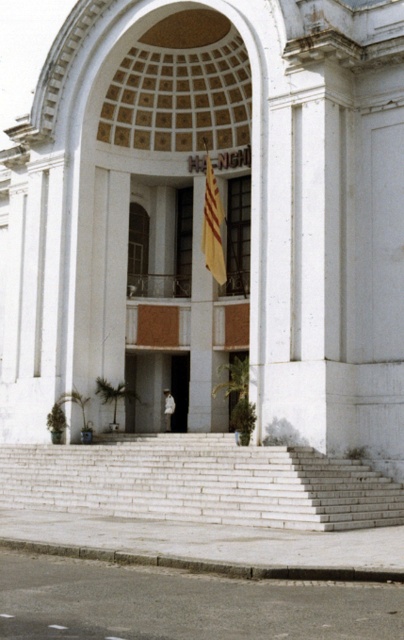
Question: Can you confirm if white stone stairs at center is positioned above white matte skateboarder at center?

Choices:
 (A) no
 (B) yes

Answer: (A)

Question: Which point is farther to the camera?

Choices:
 (A) (122, 248)
 (B) (208, 259)
 (C) (174, 406)
 (D) (187, 454)

Answer: (C)

Question: Estimate the real-world distances between objects in this image. Which object is closer to the white matte skateboarder at center?

Choices:
 (A) yellow fabric flag at center
 (B) white stone stairs at center
 (C) white stone archway at center

Answer: (C)

Question: Which object is positioned farthest from the white matte skateboarder at center?

Choices:
 (A) white stone archway at center
 (B) yellow fabric flag at center
 (C) white stone stairs at center

Answer: (C)

Question: Observing the image, what is the correct spatial positioning of yellow fabric flag at center in reference to white matte skateboarder at center?

Choices:
 (A) above
 (B) below

Answer: (A)

Question: From the image, what is the correct spatial relationship of white stone stairs at center in relation to white matte skateboarder at center?

Choices:
 (A) right
 (B) left

Answer: (B)